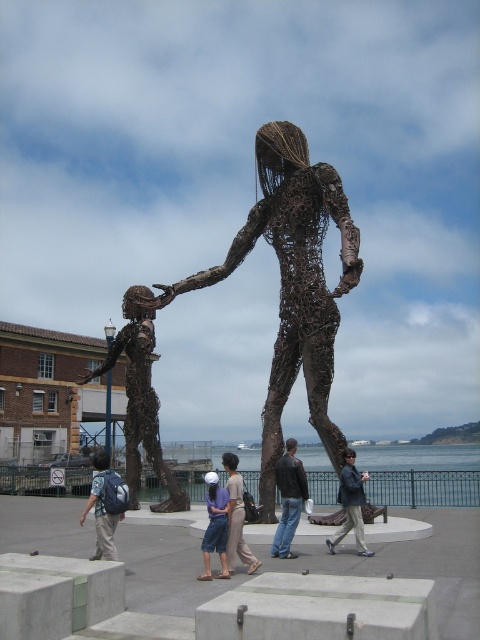
You are an artist planning to photograph the leather jacket at center and denim pants at center from a distance of 5 meters. Which object will appear wider in the photo?

The leather jacket at center will appear wider in the photo because its width is larger than that of the denim pants at center.

You are a delivery robot with a 2.5 meter long package. You need to move from the leather jacket at center to the denim shorts at center. Can you fit the package between them without tilting it?

The distance between the leather jacket at center and the denim shorts at center is 2.95 meters, which is greater than the 2.5 meter length of the package. Therefore, the package can fit between them without tilting.

You are an art curator planning to install a new sculpture in the same location. You have a small statue that needs to be placed below the bronze wireframe figure at center. Where should you position it relative to the dark brown leather jacket at center?

The bronze wireframe figure at center is above the dark brown leather jacket at center, so you should place the new statue below the bronze wireframe figure at center, which would be near the location of the dark brown leather jacket at center.